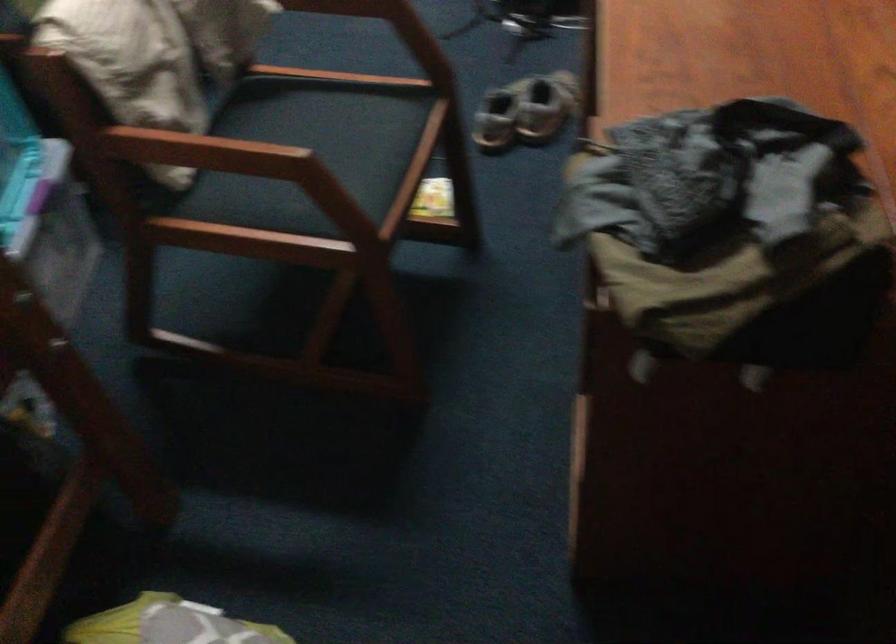
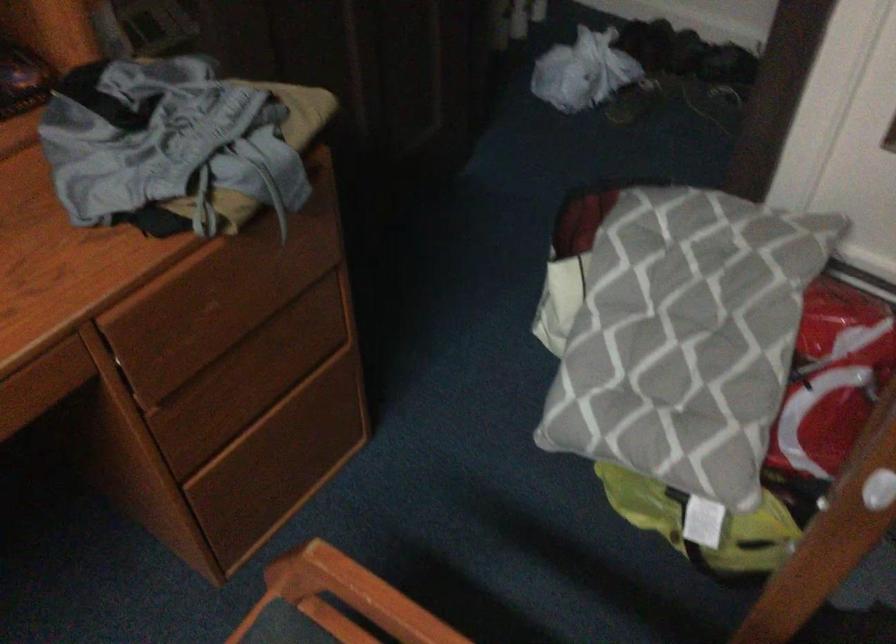
Find the pixel in the second image that matches point 591,216 in the first image.

(196, 294)